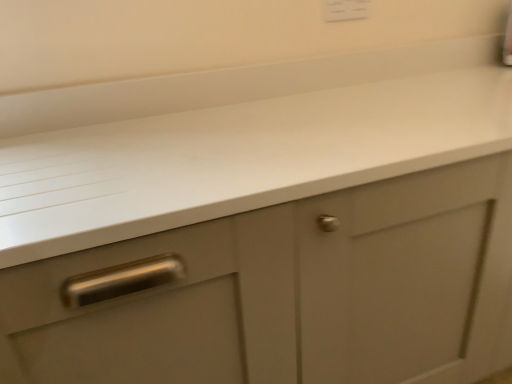
Question: From the image's perspective, is white matte countertop at center above or below white plastic electric outlet at upper center?

Choices:
 (A) below
 (B) above

Answer: (A)

Question: Considering the positions of white matte countertop at center and white plastic electric outlet at upper center in the image, is white matte countertop at center taller or shorter than white plastic electric outlet at upper center?

Choices:
 (A) short
 (B) tall

Answer: (B)

Question: In terms of width, does white matte countertop at center look wider or thinner when compared to white plastic electric outlet at upper center?

Choices:
 (A) wide
 (B) thin

Answer: (A)

Question: From the image's perspective, relative to white matte countertop at center, is white plastic electric outlet at upper center above or below?

Choices:
 (A) below
 (B) above

Answer: (B)

Question: Is white plastic electric outlet at upper center bigger or smaller than white matte countertop at center?

Choices:
 (A) big
 (B) small

Answer: (B)

Question: From a real-world perspective, is white plastic electric outlet at upper center physically located above or below white matte countertop at center?

Choices:
 (A) above
 (B) below

Answer: (A)

Question: Looking at their shapes, would you say white plastic electric outlet at upper center is wider or thinner than white matte countertop at center?

Choices:
 (A) wide
 (B) thin

Answer: (B)